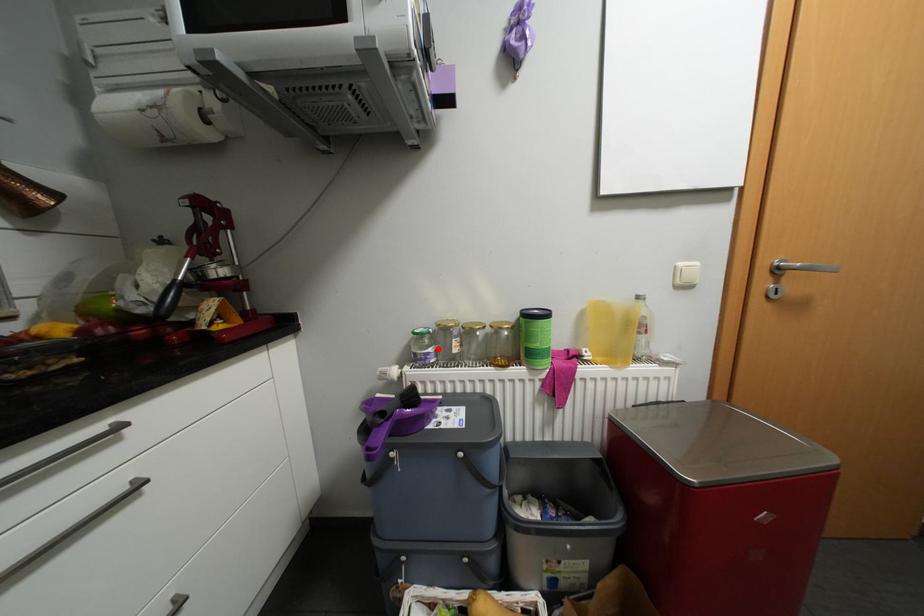
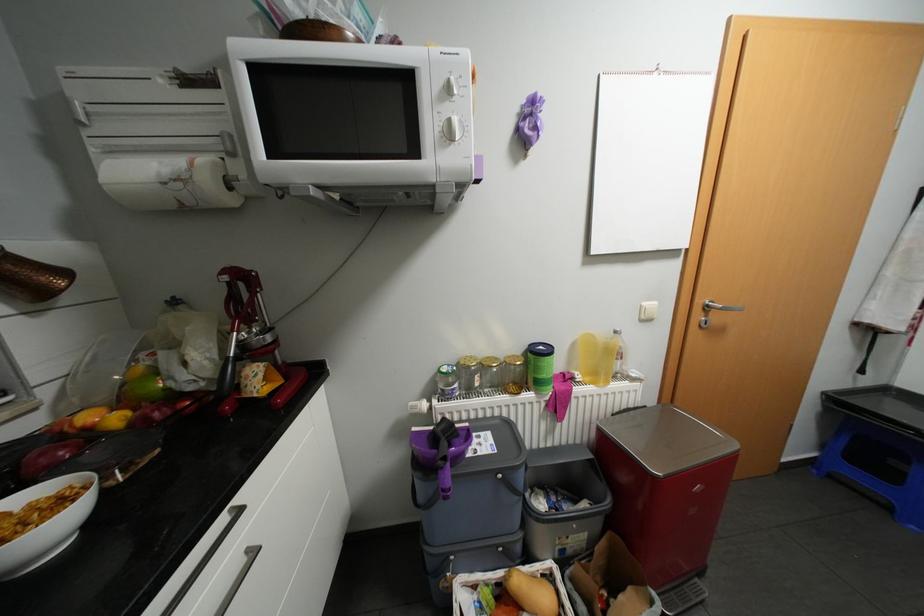
The point at the highlighted location is marked in the first image. Where is the corresponding point in the second image?

(464, 384)